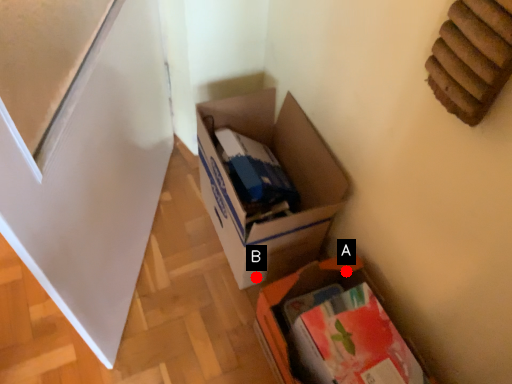
Question: Two points are circled on the image, labeled by A and B beside each circle. Among these points, which one is farthest from the camera?

Choices:
 (A) A is further
 (B) B is further

Answer: (B)